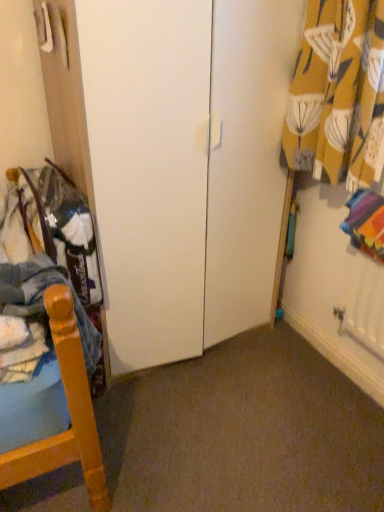
Question: Is denim fabric pants at left located outside yellow floral fabric at upper right?

Choices:
 (A) yes
 (B) no

Answer: (A)

Question: Is denim fabric pants at left taller than yellow floral fabric at upper right?

Choices:
 (A) yes
 (B) no

Answer: (B)

Question: Is denim fabric pants at left positioned far away from yellow floral fabric at upper right?

Choices:
 (A) yes
 (B) no

Answer: (B)

Question: Considering the relative sizes of denim fabric pants at left and yellow floral fabric at upper right in the image provided, is denim fabric pants at left smaller than yellow floral fabric at upper right?

Choices:
 (A) no
 (B) yes

Answer: (B)

Question: Is denim fabric pants at left to the left of yellow floral fabric at upper right from the viewer's perspective?

Choices:
 (A) yes
 (B) no

Answer: (A)

Question: Considering the relative sizes of denim fabric pants at left and yellow floral fabric at upper right in the image provided, is denim fabric pants at left bigger than yellow floral fabric at upper right?

Choices:
 (A) no
 (B) yes

Answer: (A)

Question: Can you confirm if yellow floral fabric at upper right is positioned to the right of denim fabric pants at left?

Choices:
 (A) no
 (B) yes

Answer: (B)

Question: Does yellow floral fabric at upper right come in front of denim fabric pants at left?

Choices:
 (A) no
 (B) yes

Answer: (A)

Question: Considering the relative sizes of yellow floral fabric at upper right and denim fabric pants at left in the image provided, is yellow floral fabric at upper right wider than denim fabric pants at left?

Choices:
 (A) yes
 (B) no

Answer: (B)

Question: Is yellow floral fabric at upper right thinner than denim fabric pants at left?

Choices:
 (A) yes
 (B) no

Answer: (A)

Question: Are yellow floral fabric at upper right and denim fabric pants at left beside each other?

Choices:
 (A) yes
 (B) no

Answer: (B)

Question: Is yellow floral fabric at upper right taller than denim fabric pants at left?

Choices:
 (A) no
 (B) yes

Answer: (B)

Question: Is point (372, 55) closer or farther from the camera than point (44, 265)?

Choices:
 (A) closer
 (B) farther

Answer: (B)